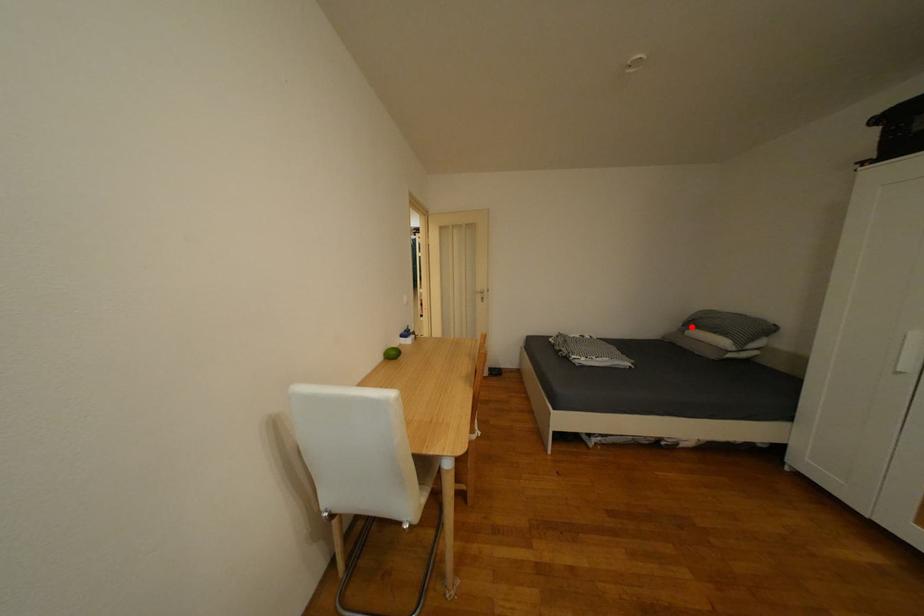
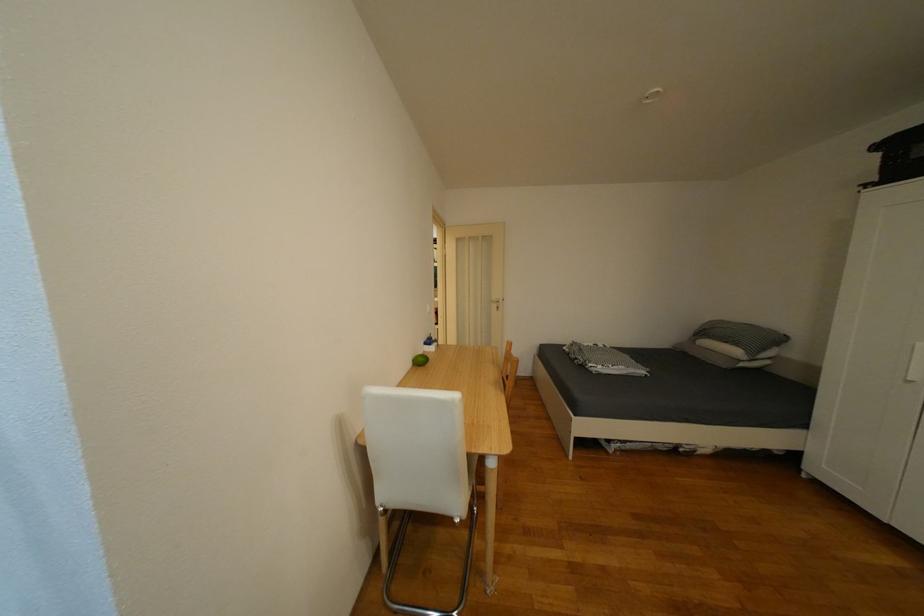
Question: I am providing you with two images of the same scene from different viewpoints. Image1 has a red point marked. In image2, the corresponding 3D location appears at what relative position? Reply with the corresponding letter.

Choices:
 (A) Closer
 (B) Farther

Answer: (B)